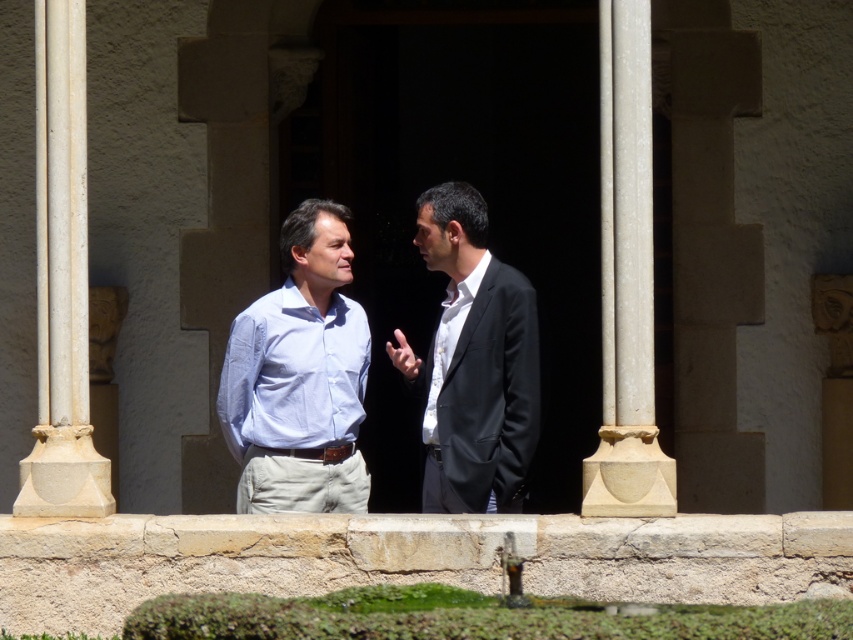
You are an architect analyzing the symmetry of the building. Based on the image, which object has a greater width between the white stone column at right and the white stone pillar at left?

The white stone column at right has a greater width than the white stone pillar at left.

You are standing in front of the classical building and want to place a decorative pot between the white stone column at right and the white stone pillar at left. Where should you place it?

The white stone column at right is positioned on the right side of white stone pillar at left, so you should place the decorative pot between them, ensuring it is centered between the two structures.